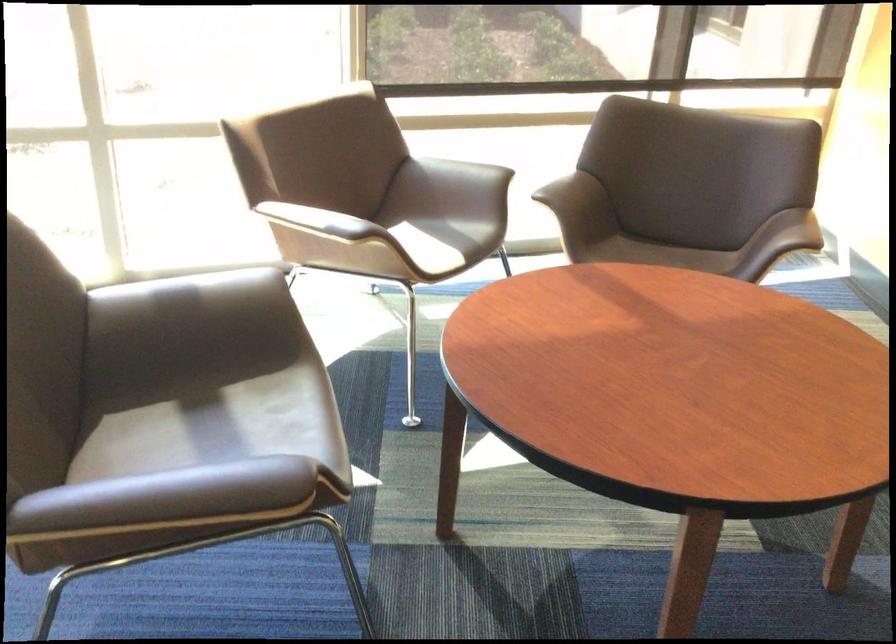
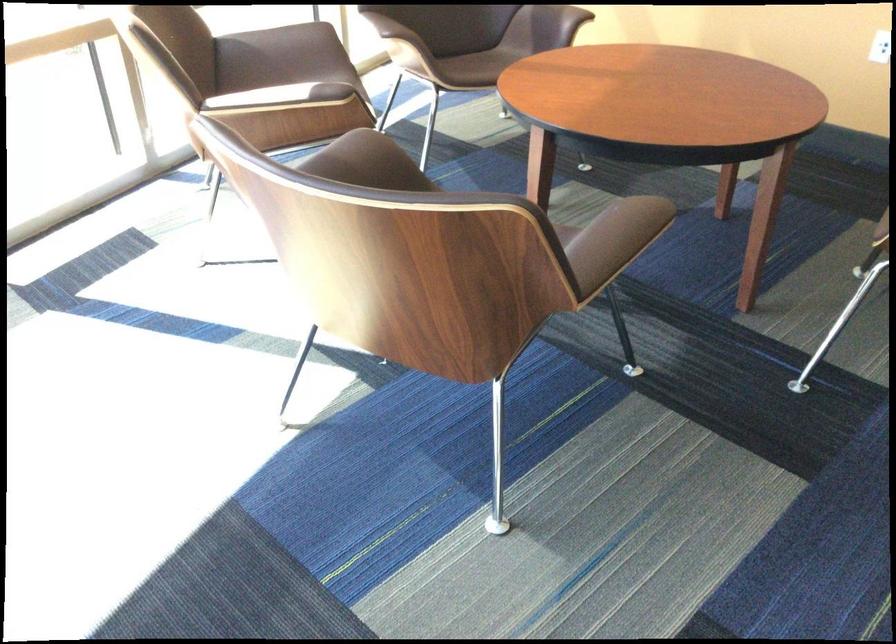
In the second image, find the point that corresponds to pixel 452 184 in the first image.

(281, 55)